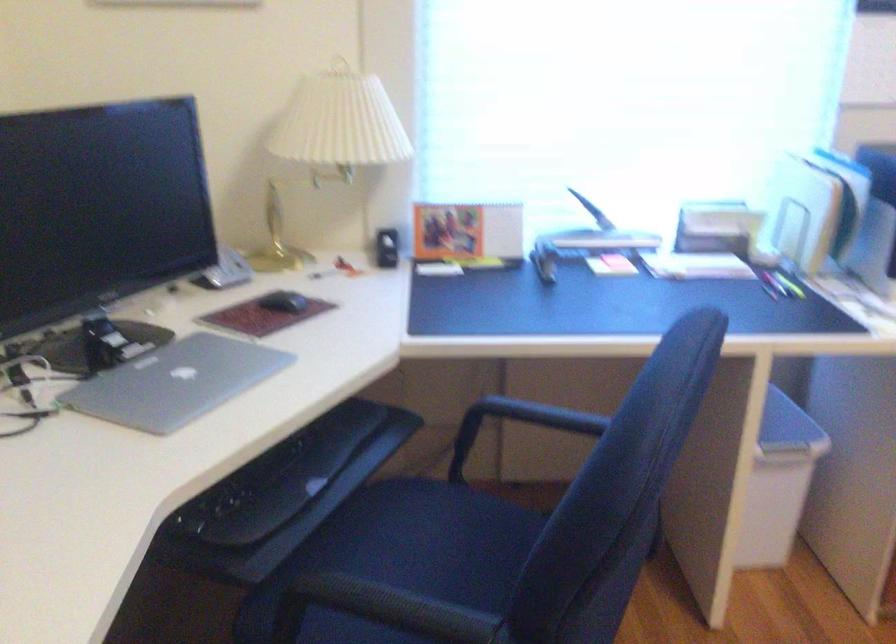
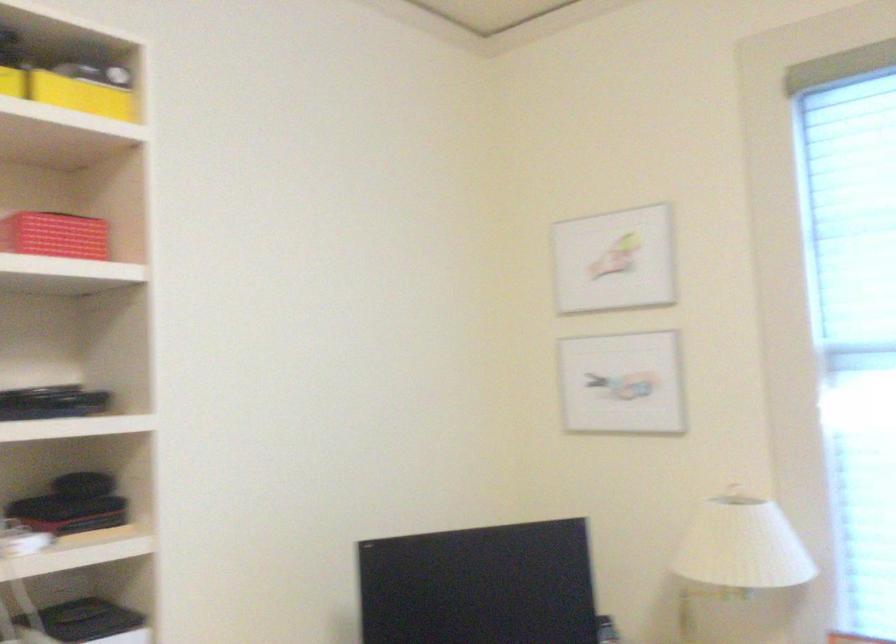
First-person continuous shooting, in which direction is the camera rotating?

The rotation direction of the camera is left-up.